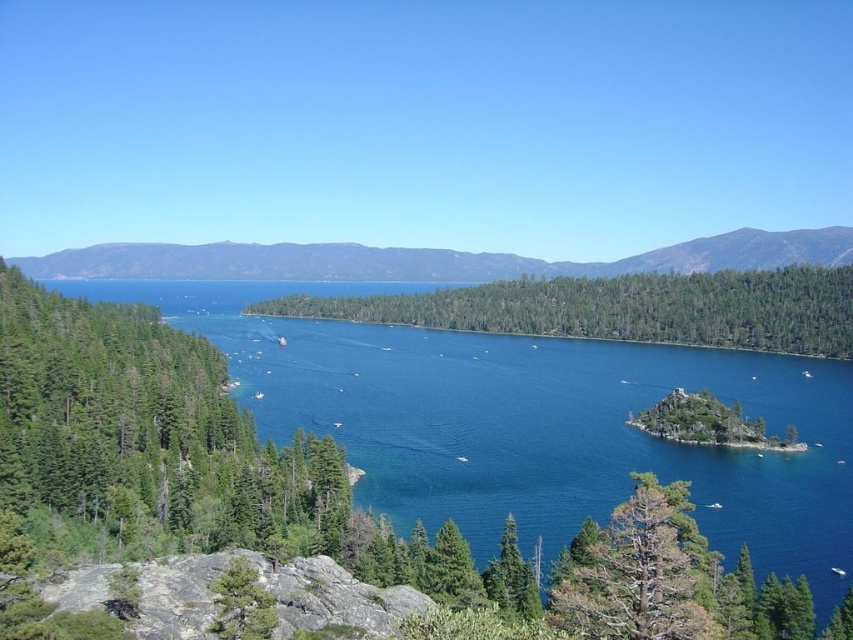
Question: Is green forested mountain at center above green matte tree at lower left?

Choices:
 (A) yes
 (B) no

Answer: (A)

Question: Which object appears closest to the camera in this image?

Choices:
 (A) green leafy island at center
 (B) green matte tree at lower left
 (C) green textured tree at center right

Answer: (C)

Question: Is green forested mountain at center further to the viewer compared to green textured tree at center right?

Choices:
 (A) yes
 (B) no

Answer: (A)

Question: In this image, where is green forested mountain at center located relative to green matte tree at lower left?

Choices:
 (A) left
 (B) right

Answer: (A)

Question: Which object is positioned closest to the deep blue water at center?

Choices:
 (A) green forested mountain at center
 (B) green leafy island at center
 (C) green textured tree at center right
 (D) green matte tree at lower left

Answer: (B)

Question: Which is nearer to the deep blue water at center?

Choices:
 (A) green matte tree at lower left
 (B) green forested mountain at center

Answer: (A)